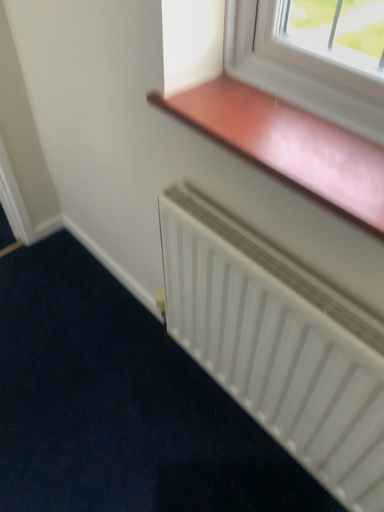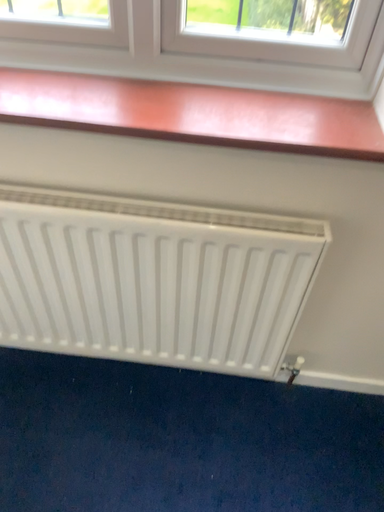
Question: Which way did the camera rotate in the video?

Choices:
 (A) rotated left
 (B) rotated right

Answer: (B)